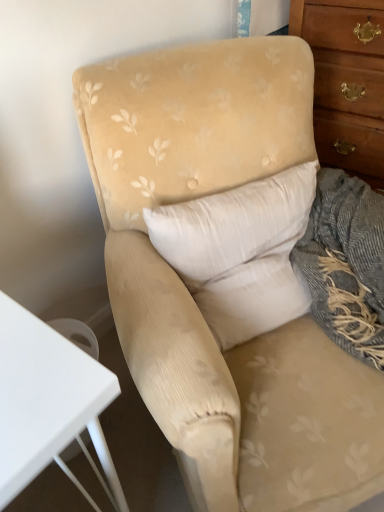
Question: Can you see wooden chest of drawers at right touching beige fabric pillow at center?

Choices:
 (A) no
 (B) yes

Answer: (A)

Question: Could you tell me if wooden chest of drawers at right is facing beige fabric pillow at center?

Choices:
 (A) yes
 (B) no

Answer: (A)

Question: Does wooden chest of drawers at right have a greater height compared to beige fabric pillow at center?

Choices:
 (A) yes
 (B) no

Answer: (A)

Question: From a real-world perspective, is wooden chest of drawers at right positioned under beige fabric pillow at center based on gravity?

Choices:
 (A) yes
 (B) no

Answer: (A)

Question: Is wooden chest of drawers at right positioned before beige fabric pillow at center?

Choices:
 (A) yes
 (B) no

Answer: (B)

Question: Is beige fabric pillow at center a part of wooden chest of drawers at right?

Choices:
 (A) yes
 (B) no

Answer: (B)

Question: Is beige fabric pillow at center not inside wooden chest of drawers at right?

Choices:
 (A) no
 (B) yes

Answer: (B)

Question: From a real-world perspective, is beige fabric pillow at center physically above wooden chest of drawers at right?

Choices:
 (A) no
 (B) yes

Answer: (B)

Question: Is beige fabric pillow at center at the left side of wooden chest of drawers at right?

Choices:
 (A) no
 (B) yes

Answer: (B)

Question: Is beige fabric pillow at center positioned far away from wooden chest of drawers at right?

Choices:
 (A) no
 (B) yes

Answer: (A)

Question: Does beige fabric pillow at center turn towards wooden chest of drawers at right?

Choices:
 (A) yes
 (B) no

Answer: (B)

Question: Is beige fabric pillow at center shorter than wooden chest of drawers at right?

Choices:
 (A) yes
 (B) no

Answer: (A)

Question: From a real-world perspective, relative to beige fabric pillow at center, is wooden chest of drawers at right vertically above or below?

Choices:
 (A) above
 (B) below

Answer: (B)